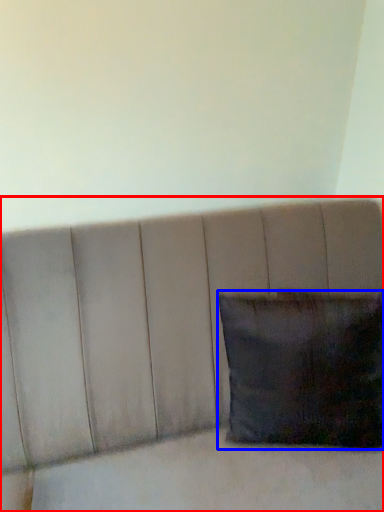
Question: Which point is closer to the camera, furniture (highlighted by a red box) or pillow (highlighted by a blue box)?

Choices:
 (A) furniture
 (B) pillow

Answer: (A)